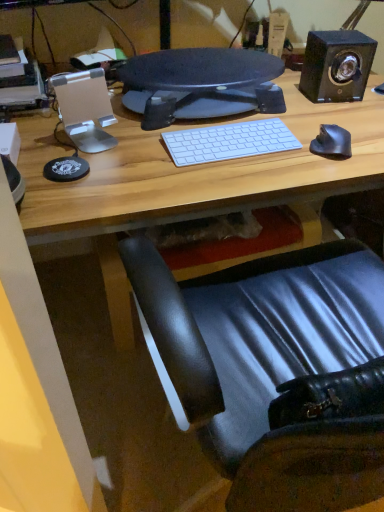
Question: Should I look upward or downward to see black leather chair at lower right?

Choices:
 (A) down
 (B) up

Answer: (A)

Question: From a real-world perspective, is white matte keyboard at center on top of matte black monitor at center?

Choices:
 (A) yes
 (B) no

Answer: (B)

Question: Considering the relative sizes of white matte keyboard at center and matte black monitor at center in the image provided, is white matte keyboard at center shorter than matte black monitor at center?

Choices:
 (A) no
 (B) yes

Answer: (B)

Question: Is white matte keyboard at center closer to camera compared to matte black monitor at center?

Choices:
 (A) no
 (B) yes

Answer: (B)

Question: Is white matte keyboard at center taller than matte black monitor at center?

Choices:
 (A) yes
 (B) no

Answer: (B)

Question: From the image's perspective, is white matte keyboard at center above matte black monitor at center?

Choices:
 (A) yes
 (B) no

Answer: (B)

Question: Is white matte keyboard at center positioned with its back to matte black monitor at center?

Choices:
 (A) yes
 (B) no

Answer: (A)

Question: Does black rubberized mouse at right have a lesser width compared to black glossy speaker at upper right?

Choices:
 (A) yes
 (B) no

Answer: (A)

Question: Is black rubberized mouse at right smaller than black glossy speaker at upper right?

Choices:
 (A) yes
 (B) no

Answer: (A)

Question: Would you say black glossy speaker at upper right is part of black rubberized mouse at right's contents?

Choices:
 (A) no
 (B) yes

Answer: (A)

Question: Considering the relative sizes of black rubberized mouse at right and black glossy speaker at upper right in the image provided, is black rubberized mouse at right wider than black glossy speaker at upper right?

Choices:
 (A) yes
 (B) no

Answer: (B)

Question: From the image's perspective, would you say black rubberized mouse at right is shown under black glossy speaker at upper right?

Choices:
 (A) yes
 (B) no

Answer: (A)

Question: Is black rubberized mouse at right facing towards black glossy speaker at upper right?

Choices:
 (A) yes
 (B) no

Answer: (B)

Question: From a real-world perspective, is matte black monitor at center located higher than black rubberized mouse at right?

Choices:
 (A) no
 (B) yes

Answer: (B)